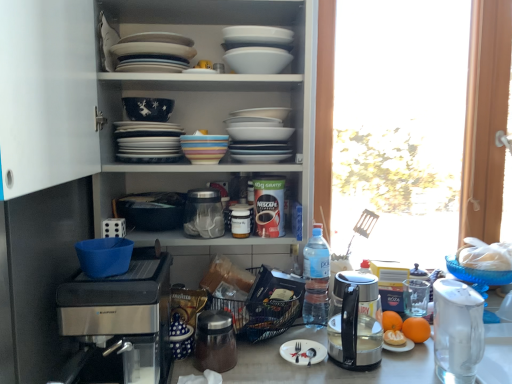
Question: Can you confirm if matte blue bowl at upper center, arranged as the first bowl when viewed from the back, is shorter than sleek stainless steel kettle at right?

Choices:
 (A) no
 (B) yes

Answer: (B)

Question: Considering the relative sizes of matte blue bowl at upper center, the 2th bowl viewed from the top, and sleek stainless steel kettle at right in the image provided, is matte blue bowl at upper center, the 2th bowl viewed from the top, wider than sleek stainless steel kettle at right?

Choices:
 (A) yes
 (B) no

Answer: (B)

Question: Are matte blue bowl at upper center, the 2th bowl viewed from the top, and sleek stainless steel kettle at right making contact?

Choices:
 (A) no
 (B) yes

Answer: (A)

Question: Does matte blue bowl at upper center, which appears as the second bowl when viewed from the right, have a greater height compared to sleek stainless steel kettle at right?

Choices:
 (A) no
 (B) yes

Answer: (A)

Question: From the image's perspective, is matte blue bowl at upper center, which appears as the 2th bowl when ordered from the bottom, on sleek stainless steel kettle at right?

Choices:
 (A) yes
 (B) no

Answer: (A)

Question: In terms of size, does blue plastic bowl at lower left, placed as the first bowl when sorted from left to right, appear bigger or smaller than matte blue bowl at upper center, which is counted as the 2th bowl, starting from the left?

Choices:
 (A) small
 (B) big

Answer: (B)

Question: Based on their positions, is blue plastic bowl at lower left, the 3th bowl when ordered from right to left, located to the left or right of matte blue bowl at upper center, which appears as the 2th bowl when ordered from the bottom?

Choices:
 (A) right
 (B) left

Answer: (B)

Question: Considering their positions, is blue plastic bowl at lower left, placed as the first bowl when sorted from left to right, located in front of or behind matte blue bowl at upper center, which appears as the second bowl when viewed from the right?

Choices:
 (A) behind
 (B) front

Answer: (B)

Question: From a real-world perspective, is blue plastic bowl at lower left, the 3th bowl viewed from the back, positioned above or below matte blue bowl at upper center, the 2th bowl viewed from the top?

Choices:
 (A) below
 (B) above

Answer: (A)

Question: Which is correct: orange matte at right is inside white glossy plates at center, the first tableware positioned from the left, or outside of it?

Choices:
 (A) inside
 (B) outside

Answer: (B)

Question: Considering the relative positions of orange matte at right and white glossy plates at center, which appears as the third tableware when viewed from the right, in the image provided, is orange matte at right to the left or to the right of white glossy plates at center, which appears as the third tableware when viewed from the right,?

Choices:
 (A) right
 (B) left

Answer: (A)

Question: Is orange matte at right wider or thinner than white glossy plates at center, the first tableware positioned from the left?

Choices:
 (A) thin
 (B) wide

Answer: (A)

Question: Is point (411, 322) closer or farther from the camera than point (178, 152)?

Choices:
 (A) farther
 (B) closer

Answer: (A)

Question: From the image's perspective, is transparent plastic jar at center above or below white matte paper plate at center?

Choices:
 (A) above
 (B) below

Answer: (A)

Question: Is point (206, 220) closer or farther from the camera than point (303, 354)?

Choices:
 (A) closer
 (B) farther

Answer: (B)